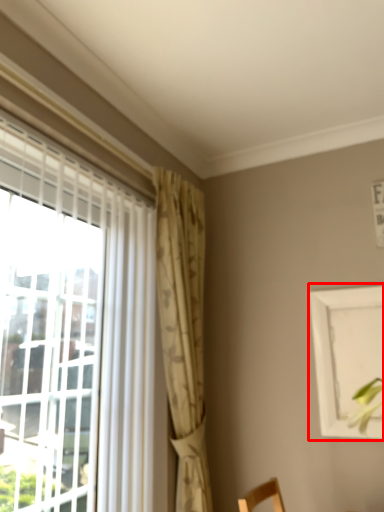
Question: Considering the relative positions of picture frame (annotated by the red box) and curtain in the image provided, where is picture frame (annotated by the red box) located with respect to the staircase?

Choices:
 (A) right
 (B) left

Answer: (A)